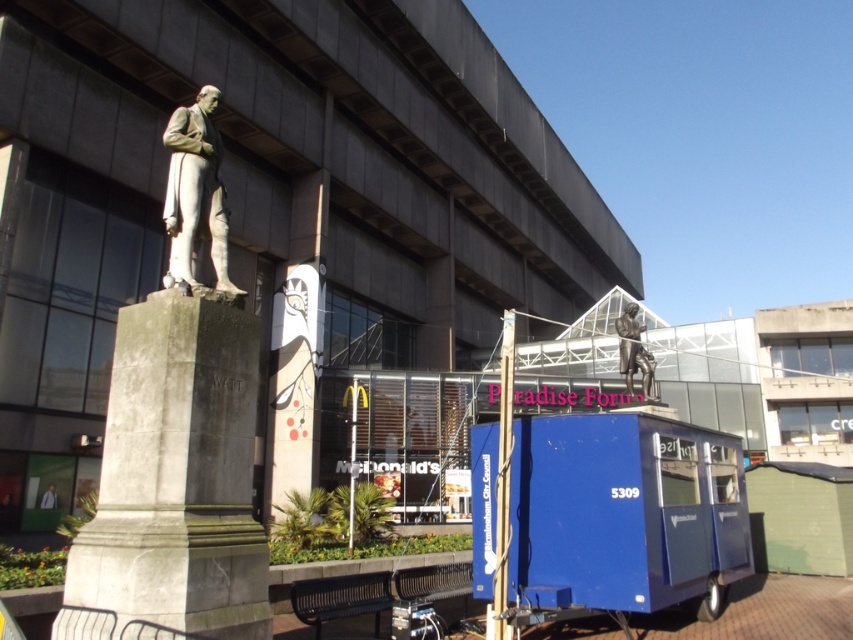
Question: Which object is closer to the camera taking this photo?

Choices:
 (A) gray stone monument at left
 (B) polished bronze statue at left

Answer: (A)

Question: Among these objects, which one is farthest from the camera?

Choices:
 (A) polished bronze statue at left
 (B) light brown leather jacket at lower left
 (C) polished bronze statue at upper center

Answer: (B)

Question: Can you confirm if polished bronze statue at left is positioned above light brown leather jacket at lower left?

Choices:
 (A) yes
 (B) no

Answer: (A)

Question: Which point is farther to the camera?

Choices:
 (A) (190, 378)
 (B) (643, 371)

Answer: (B)

Question: Can you confirm if polished bronze statue at left is positioned to the right of polished bronze statue at upper center?

Choices:
 (A) no
 (B) yes

Answer: (A)

Question: Is polished bronze statue at left closer to the viewer compared to polished bronze statue at upper center?

Choices:
 (A) yes
 (B) no

Answer: (A)